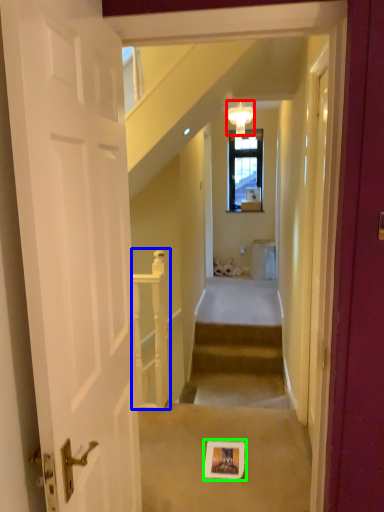
Question: Based on their relative distances, which object is nearer to light fixture (highlighted by a red box)? Choose from rail (highlighted by a blue box) and picture frame (highlighted by a green box).

Choices:
 (A) rail
 (B) picture frame

Answer: (A)